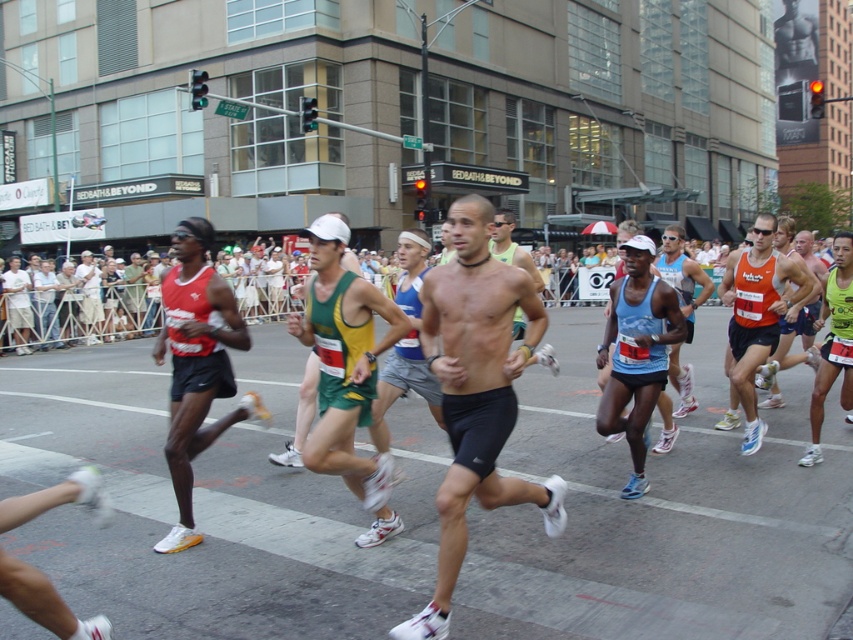
In the scene shown: You are a photographer at the marathon race. You want to capture a photo of the orange mesh tank top at center. Where should you aim your camera?

You should aim your camera at point (756, 314) to capture the orange mesh tank top at center.